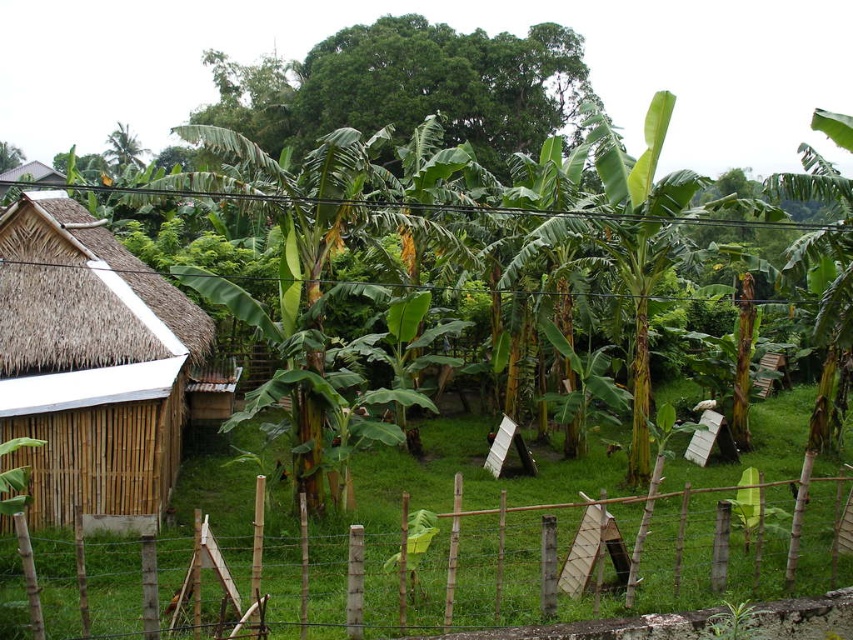
You are standing at the point indicated by point (x=90, y=362) in the image. Looking towards the bamboo structure with a thatched roof, which direction should you face to see the corrugated metal roof visible in the background?

The corrugated metal roof is visible in the background adjacent to the main bamboo structure. Since you are at point (x=90, y=362), which is near the bamboo thatched hut at left, facing towards the corrugated metal roof would require turning to your right or left depending on their relative positions. However, based on the description, the corrugated metal roof is part of another building adjacent to the main structure. Since the main structure is a bamboo structure with a thatched roof, the corrugated metal